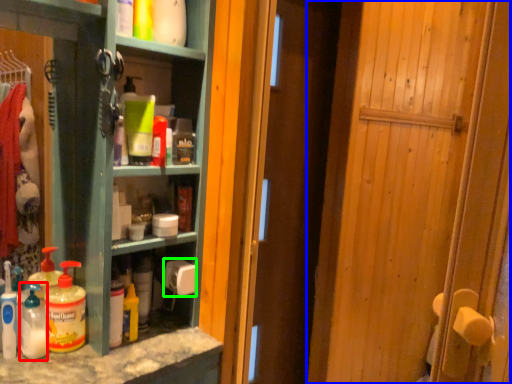
Question: Based on their relative distances, which object is farther from cleaning product (highlighted by a red box)? Choose from door (highlighted by a blue box) and toilet paper (highlighted by a green box).

Choices:
 (A) door
 (B) toilet paper

Answer: (A)